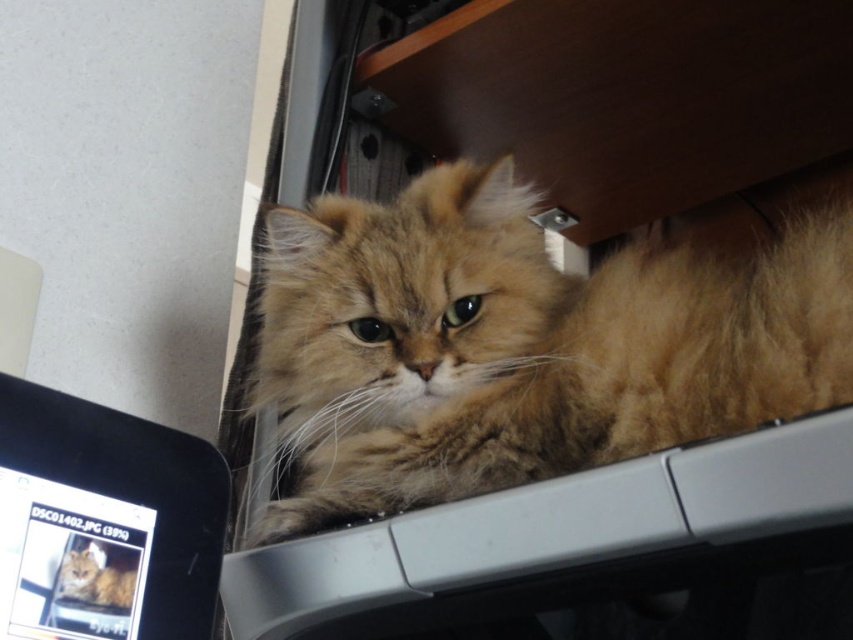
You are an observer looking at the desk where both the fuzzy golden cat at center and the fuzzy golden cat at upper right are located. Which cat is positioned more to the left?

The fuzzy golden cat at upper right is positioned more to the left because the fuzzy golden cat at center is to the right of it.

You are trying to place a new keyboard that is 18 inches wide on the desk. The desk has the fuzzy golden cat at center and the matte black monitor at lower left. Can the keyboard fit between them without moving either object?

The fuzzy golden cat at center might be wider than matte black monitor at lower left, so the space between them may not be sufficient for the keyboard. Check the actual width before placing it.